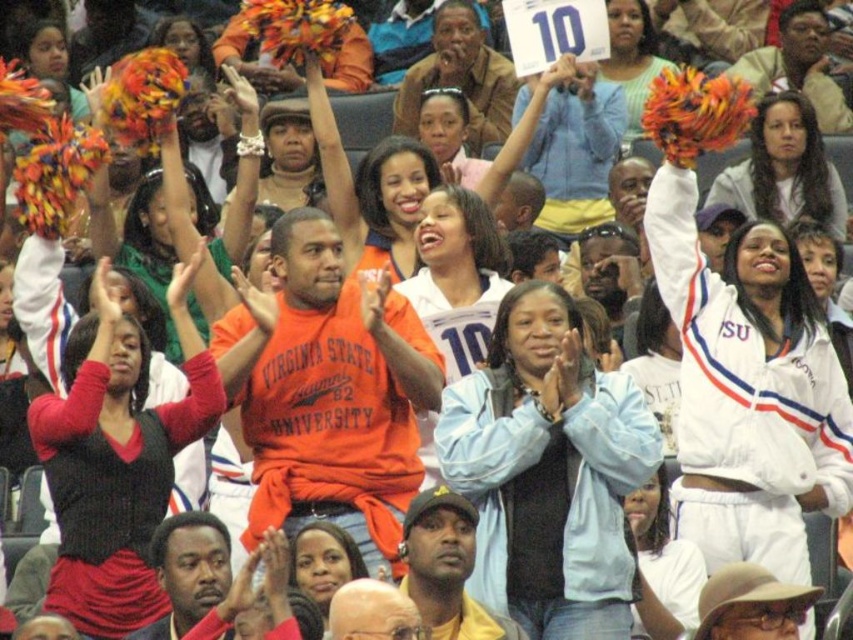
Does knit sweater at center lie in front of light blue jersey at center?

Yes.

Where is `knit sweater at center`? The height and width of the screenshot is (640, 853). knit sweater at center is located at coordinates (119, 461).

Consider the image. Does orange jersey at center appear on the right side of light blue jersey at center?

No, orange jersey at center is not to the right of light blue jersey at center.

Is orange jersey at center below light blue jersey at center?

Indeed, orange jersey at center is positioned under light blue jersey at center.

The image size is (853, 640). In order to click on orange jersey at center in this screenshot , I will do `click(393, 202)`.

Who is lower down, white fleece jacket at upper right or orange jersey at center?

Positioned lower is orange jersey at center.

Which is behind, point (770, 131) or point (412, 150)?

The point (770, 131) is behind.

The width and height of the screenshot is (853, 640). What are the coordinates of `white fleece jacket at upper right` in the screenshot? It's located at (784, 170).